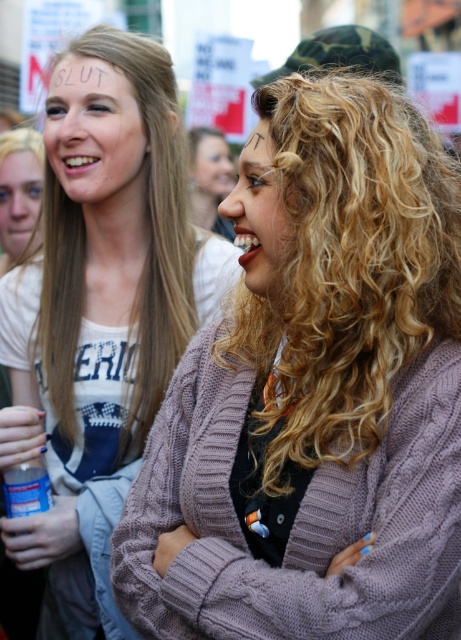
Question: Which point appears closest to the camera in this image?

Choices:
 (A) [x=366, y=200]
 (B) [x=83, y=90]
 (C) [x=208, y=152]

Answer: (A)

Question: Does white cable-knit sweater at upper left appear on the left side of curly hair at center?

Choices:
 (A) yes
 (B) no

Answer: (A)

Question: Which object appears farthest from the camera in this image?

Choices:
 (A) curly blonde hair at center
 (B) white cable-knit sweater at upper left

Answer: (B)

Question: Which point is farther from the camera taking this photo?

Choices:
 (A) (83, 76)
 (B) (297, 118)
 (C) (260, 285)

Answer: (A)

Question: Is curly blonde hair at center behind smooth skin face at center?

Choices:
 (A) no
 (B) yes

Answer: (A)

Question: In this image, where is white cable-knit sweater at upper left located relative to curly hair at center?

Choices:
 (A) above
 (B) below

Answer: (B)